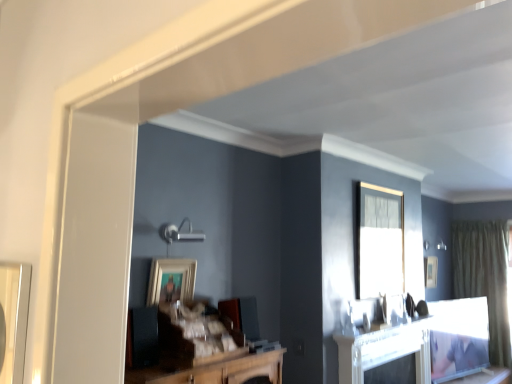
Question: Is point (379, 244) closer or farther from the camera than point (417, 380)?

Choices:
 (A) closer
 (B) farther

Answer: (A)

Question: Considering their positions, is clear glass window at upper center located in front of or behind white glossy fireplace at center?

Choices:
 (A) front
 (B) behind

Answer: (B)

Question: Which object is positioned closest to the wooden framed picture at center, positioned as the second picture frame in right-to-left order?

Choices:
 (A) white glossy fireplace at center
 (B) matte black picture frame at upper right, which is counted as the 1th picture frame, starting from the back
 (C) clear glass window at upper center
 (D) wooden table at lower right
 (E) green textured curtain at right

Answer: (A)

Question: Which object is the closest to the clear glass window at upper center?

Choices:
 (A) matte black picture frame at upper right, marked as the first picture frame in a bottom-to-top arrangement
 (B) wooden framed picture at center, which appears as the 2th picture frame when viewed from the back
 (C) white glossy fireplace at center
 (D) wooden table at lower right
 (E) green textured curtain at right

Answer: (C)